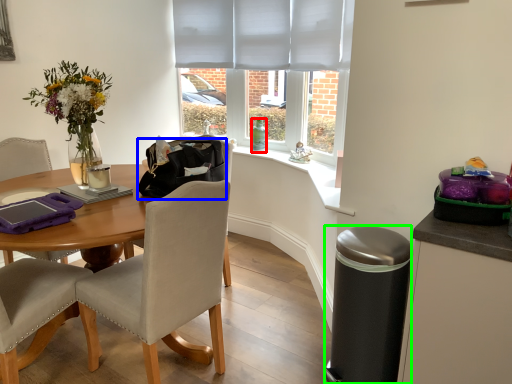
Question: Which object is the farthest from bottle (highlighted by a red box)? Choose among these: handbag (highlighted by a blue box) or trash bin/can (highlighted by a green box).

Choices:
 (A) handbag
 (B) trash bin/can

Answer: (B)